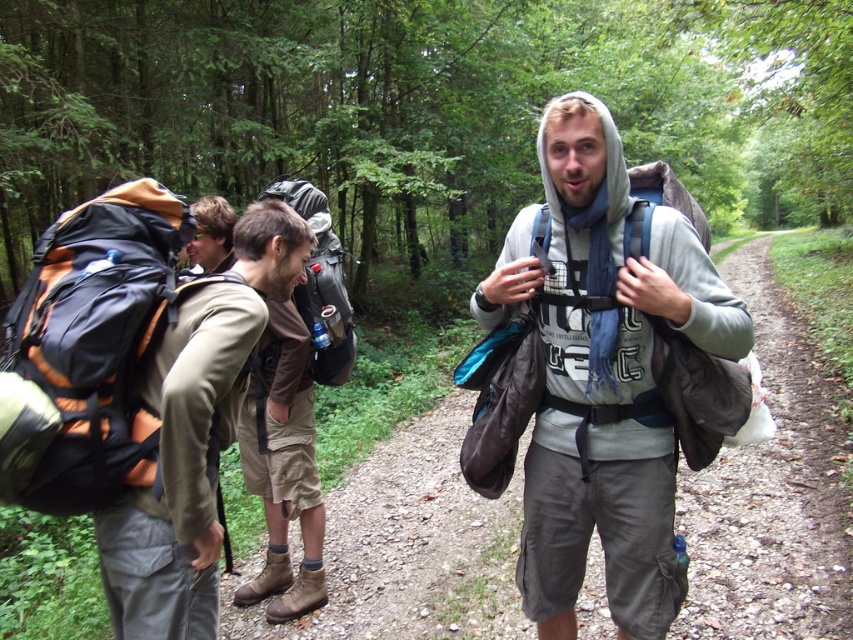
Question: Does gray fabric hoodie at center lie behind matte khaki pants at center?

Choices:
 (A) yes
 (B) no

Answer: (A)

Question: Which point appears farthest from the camera in this image?

Choices:
 (A) (234, 252)
 (B) (79, 317)
 (C) (352, 340)

Answer: (C)

Question: Estimate the real-world distances between objects in this image. Which object is closer to the matte khaki pants at center?

Choices:
 (A) gray fabric hoodie at center
 (B) orange fabric backpack at left
 (C) matte black backpack at center

Answer: (B)

Question: Estimate the real-world distances between objects in this image. Which object is closer to the matte black backpack at center?

Choices:
 (A) matte khaki pants at center
 (B) orange fabric backpack at left
 (C) gray fabric hoodie at center

Answer: (A)

Question: Does gray fabric hoodie at center appear on the right side of matte khaki pants at center?

Choices:
 (A) yes
 (B) no

Answer: (A)

Question: Is gray fabric hoodie at center to the right of orange fabric backpack at left from the viewer's perspective?

Choices:
 (A) no
 (B) yes

Answer: (B)